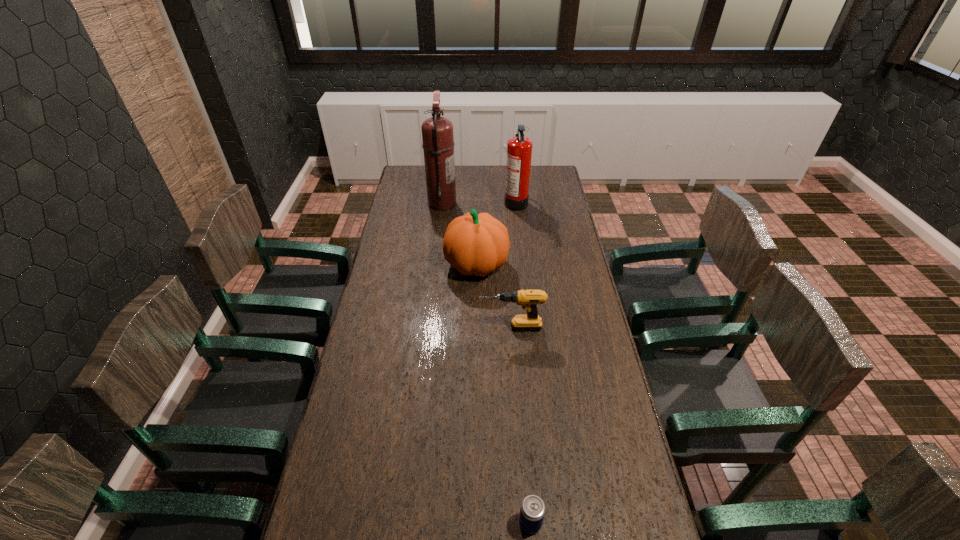
This screenshot has width=960, height=540. I want to click on free location at the left edge of the desktop, so click(378, 295).

In the image, there is a desktop. Identify the location of free space at the right edge. (556, 211).

Locate an element on the screen. The height and width of the screenshot is (540, 960). vacant space at the far left corner of the desktop is located at coordinates (407, 183).

Locate an element on the screen. The width and height of the screenshot is (960, 540). free spot between the second tallest object and the taller fire extinguisher is located at coordinates (479, 202).

This screenshot has width=960, height=540. In order to click on blank region between the beer can and the third shortest object in this screenshot , I will do [x=503, y=394].

Locate an element on the screen. The width and height of the screenshot is (960, 540). vacant area between the pumpkin and the shortest object is located at coordinates [x=503, y=394].

The height and width of the screenshot is (540, 960). Find the location of `free space between the drill and the beer can`. free space between the drill and the beer can is located at coordinates (520, 425).

The width and height of the screenshot is (960, 540). I want to click on unoccupied position between the shortest object and the third tallest object, so click(503, 394).

Where is `object that stands as the third closest to the tallest object`? object that stands as the third closest to the tallest object is located at coordinates (529, 299).

Locate an element on the screen. The height and width of the screenshot is (540, 960). object that stands as the second closest to the drill is located at coordinates (532, 511).